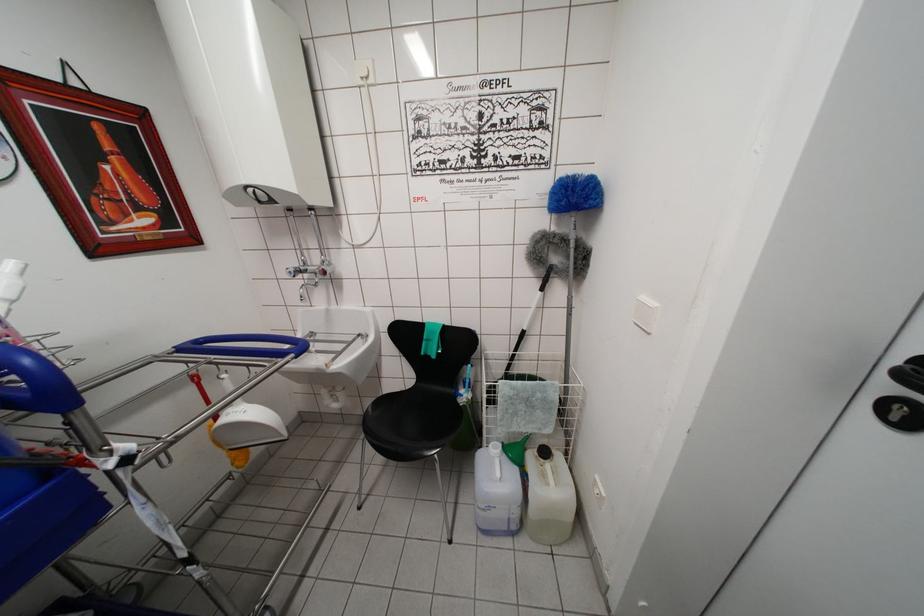
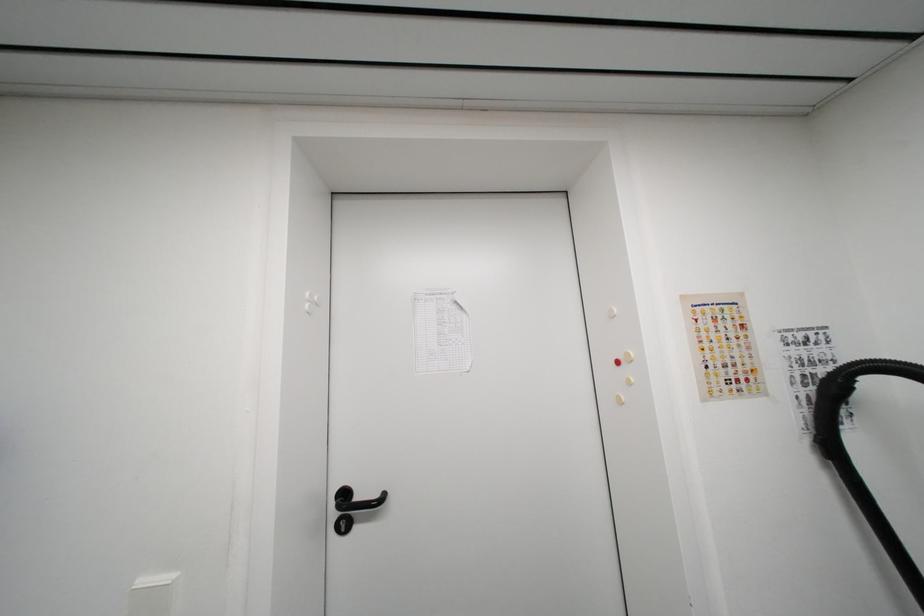
Question: The camera is either moving clockwise (left) or counter-clockwise (right) around the object. The first image is from the beginning of the video and the second image is from the end. Is the camera moving left or right when shooting the video?

Choices:
 (A) Left
 (B) Right

Answer: (A)